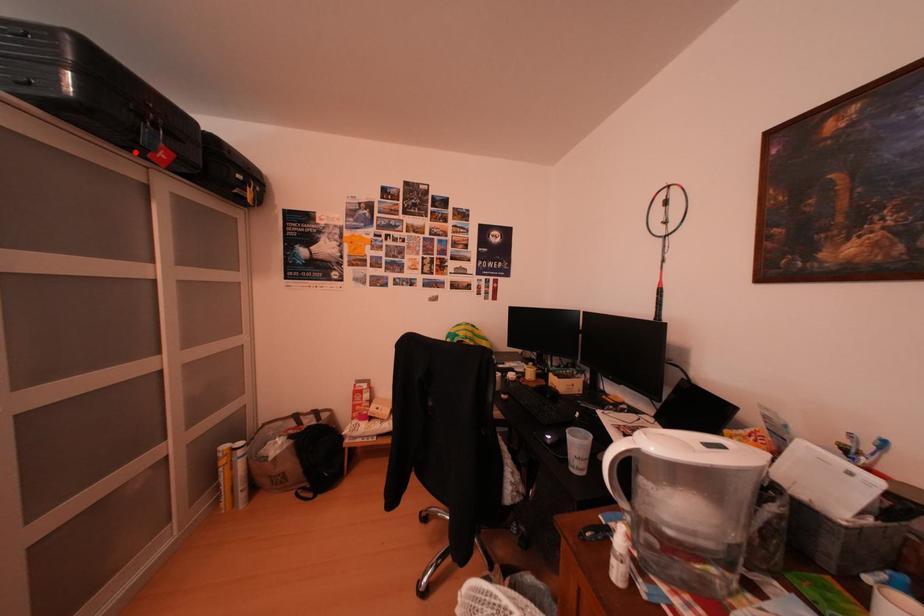
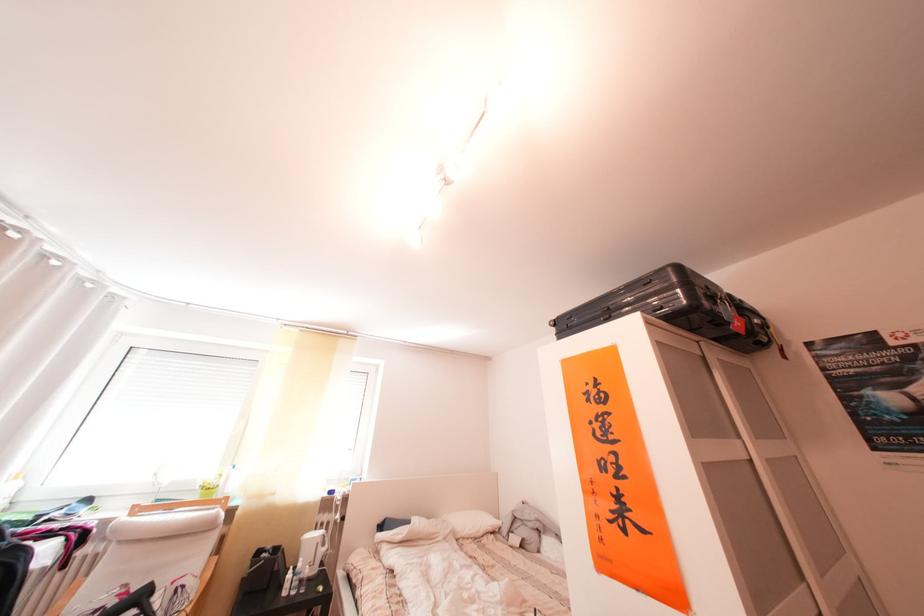
Where in the second image is the point corresponding to the highlighted location from the first image?

(703, 336)